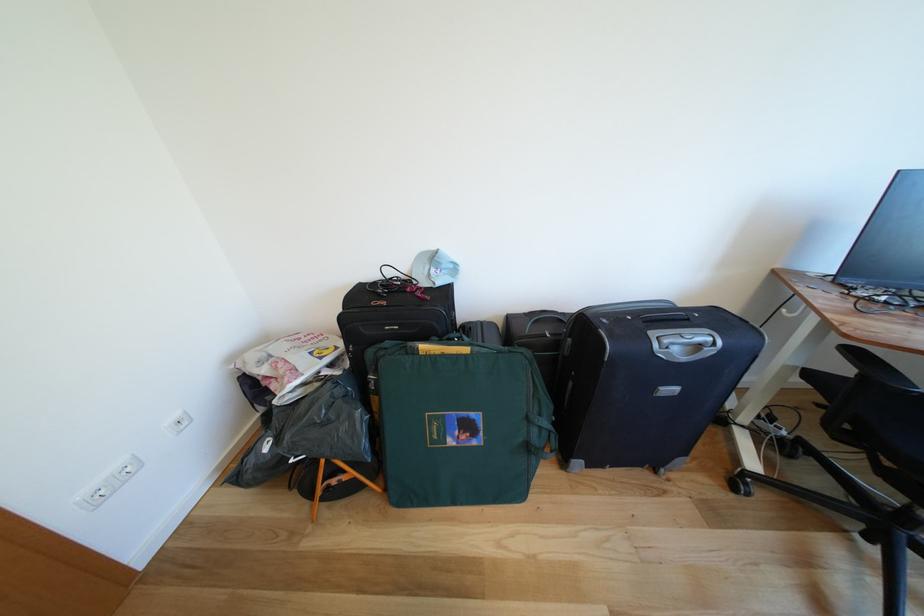
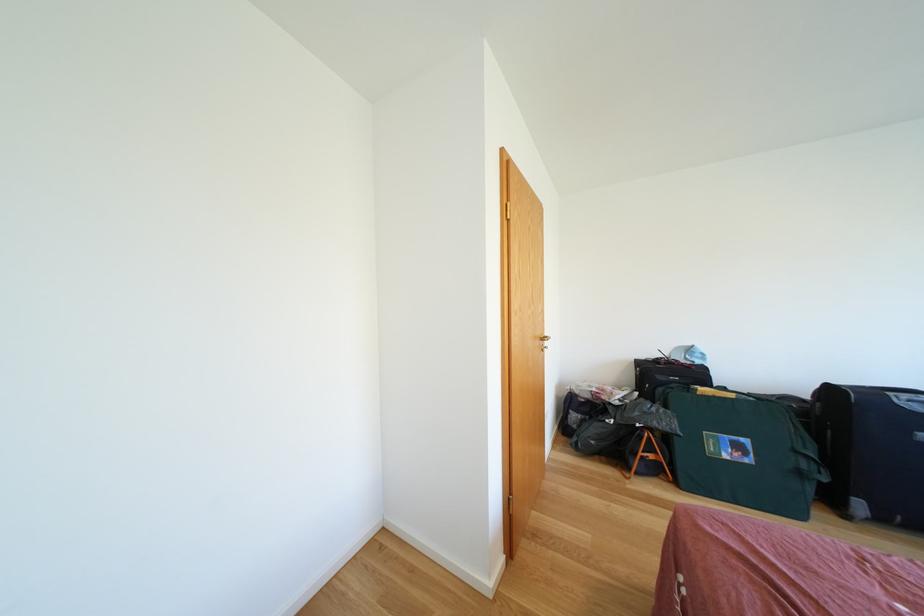
Find the pixel in the second image that matches the point at 475,354 in the first image.

(739, 400)